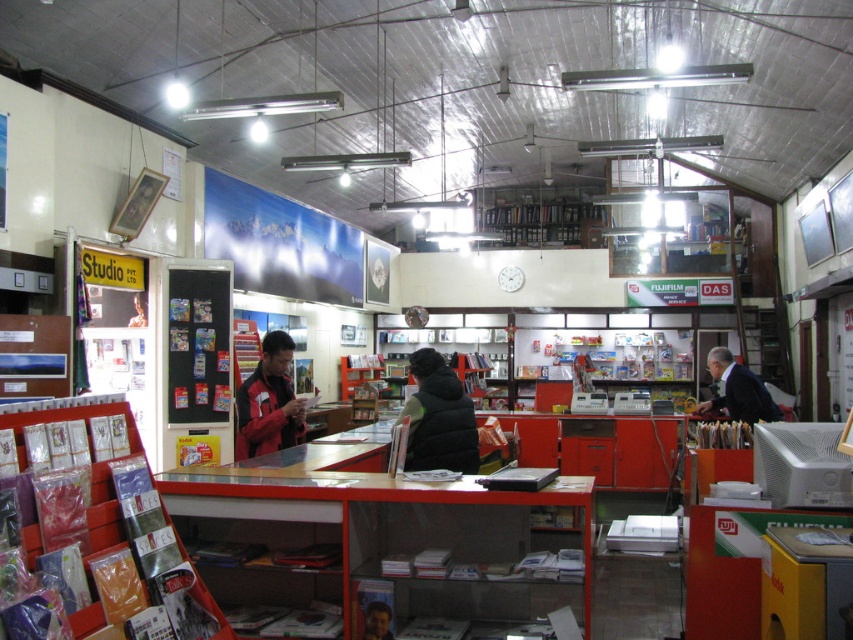
You are a customer in the shop looking for a jacket. You see the black fuzzy jacket at center and the dark suit at right. Which item is positioned closer to the left side of the shop?

The black fuzzy jacket at center is positioned to the left of the dark suit at right, so it is closer to the left side of the shop.

You are a customer in the shop and want to ask for assistance. The store clerk is wearing a dark suit at right and has a smooth skin face at center. Which direction should you walk to approach the clerk?

The dark suit at right is positioned on the right side of smooth skin face at center, so you should walk to the right to approach the clerk.